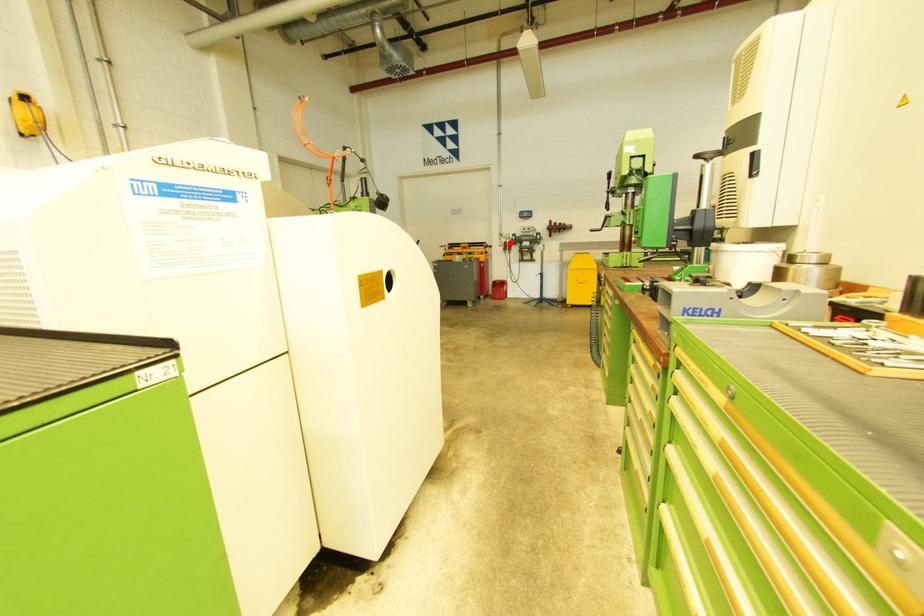
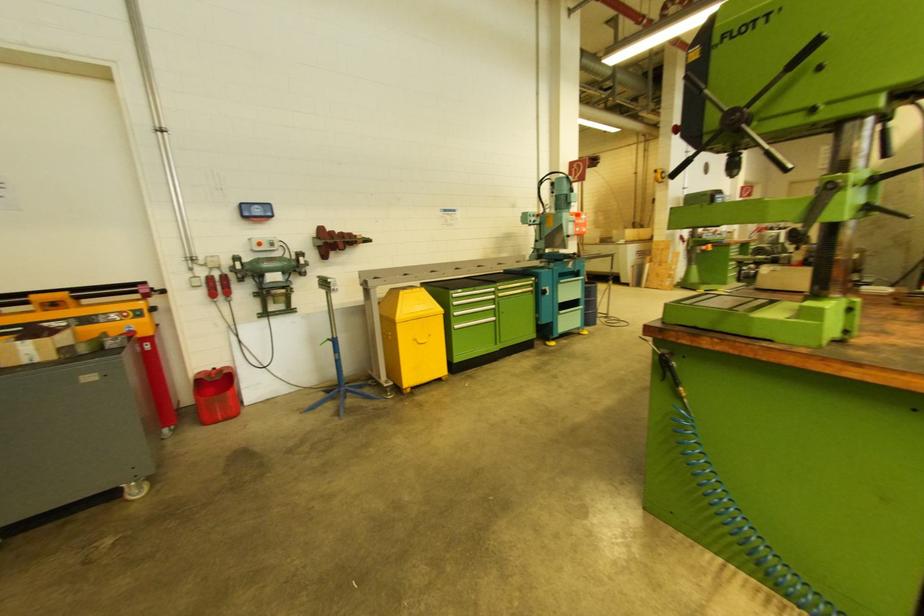
Question: A red point is marked in image1. In image2, is the corresponding 3D point closer to the camera or farther? Reply with the corresponding letter.

Choices:
 (A) The corresponding 3D point is closer.
 (B) The corresponding 3D point is farther.

Answer: (B)